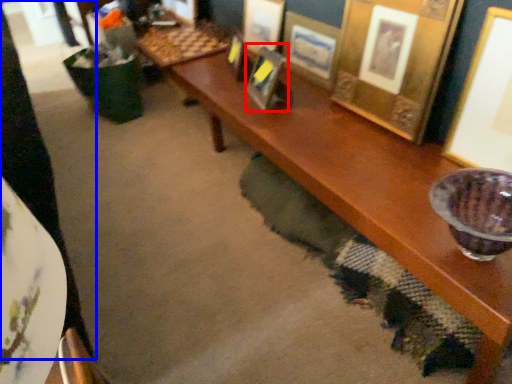
Question: Which object appears closest to the camera in this image, picture frame (highlighted by a red box) or person (highlighted by a blue box)?

Choices:
 (A) picture frame
 (B) person

Answer: (B)